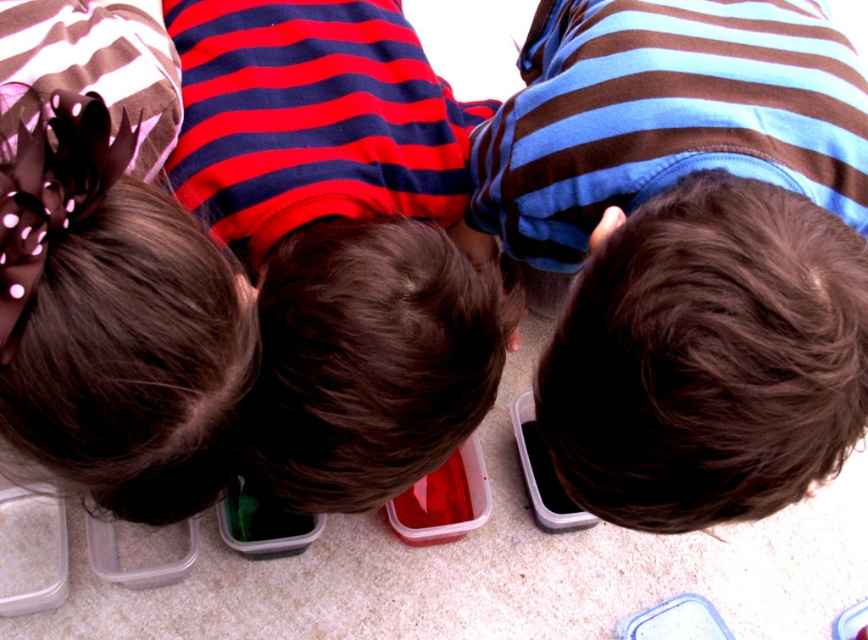
Can you confirm if brown striped shirt at center is positioned to the right of red striped shirt at center?

Correct, you'll find brown striped shirt at center to the right of red striped shirt at center.

Between point (632, 282) and point (279, 428), which one is positioned behind?

Positioned behind is point (279, 428).

Find the location of a particular element. The width and height of the screenshot is (868, 640). brown striped shirt at center is located at coordinates (689, 250).